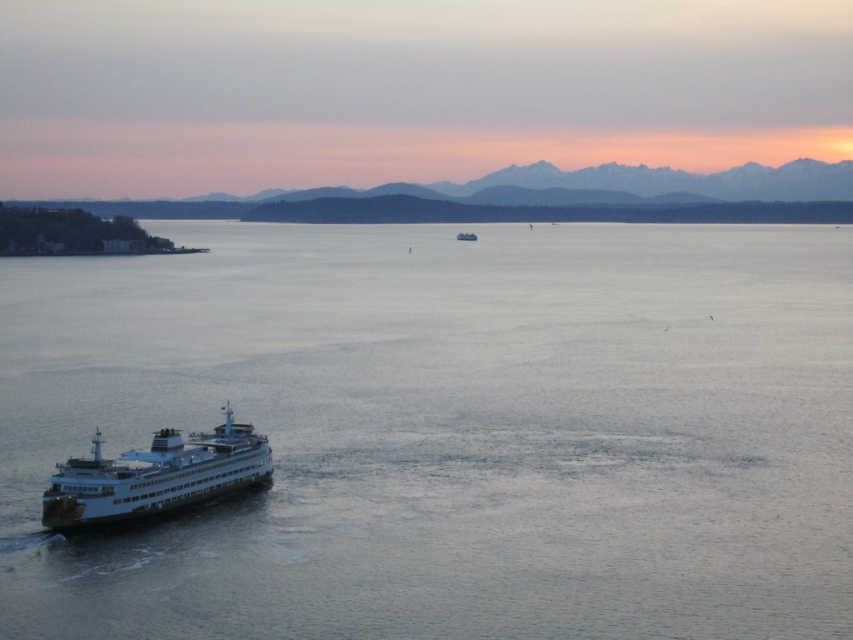
Is the position of sandy brown mountains at upper center more distant than that of white matte ferry at center?

That is True.

In the scene shown: Is sandy brown mountains at upper center bigger than white matte ferry at center?

Yes.

Identify the location of sandy brown mountains at upper center. The width and height of the screenshot is (853, 640). (538, 196).

The width and height of the screenshot is (853, 640). In order to click on sandy brown mountains at upper center in this screenshot , I will do `click(538, 196)`.

Identify the location of white glossy ferry at lower left. The height and width of the screenshot is (640, 853). (155, 476).

What do you see at coordinates (155, 476) in the screenshot?
I see `white glossy ferry at lower left` at bounding box center [155, 476].

Where is `white glossy ferry at lower left`? This screenshot has height=640, width=853. white glossy ferry at lower left is located at coordinates (155, 476).

Is clear water at center shorter than sandy brown mountains at upper center?

No.

Is point (585, 440) closer to camera compared to point (631, 200)?

Yes, point (585, 440) is closer to viewer.

The height and width of the screenshot is (640, 853). In order to click on clear water at center in this screenshot , I will do `click(447, 433)`.